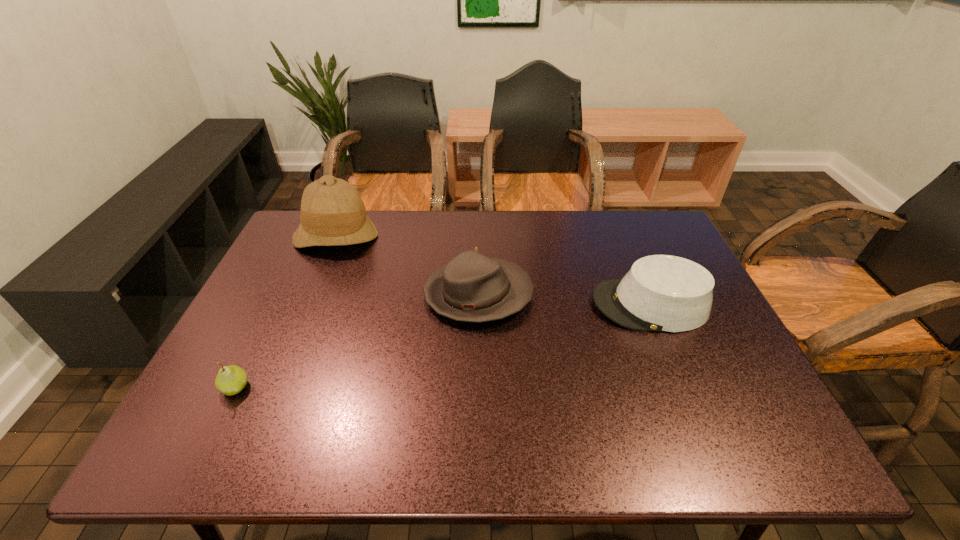
In order to click on vacant region located 0.310m on the back of the pear in this screenshot , I will do `click(286, 285)`.

At what (x,y) coordinates should I click in order to perform the action: click on object situated at the far edge. Please return your answer as a coordinate pair (x, y). The height and width of the screenshot is (540, 960). Looking at the image, I should click on (332, 213).

You are a GUI agent. You are given a task and a screenshot of the screen. Output one action in this format:
    pyautogui.click(x=<x>, y=<y>)
    Task: Click on the hat that is at the left edge
    
    Given the screenshot: What is the action you would take?
    pyautogui.click(x=332, y=213)

In order to click on pear that is at the left edge in this screenshot , I will do `click(230, 380)`.

In order to click on object at the right edge in this screenshot , I will do `click(665, 293)`.

Locate an element on the screen. Image resolution: width=960 pixels, height=540 pixels. object that is at the far left corner is located at coordinates (332, 213).

Find the location of `vacant area at the far edge`. vacant area at the far edge is located at coordinates (523, 218).

The height and width of the screenshot is (540, 960). I want to click on free space at the near edge of the desktop, so click(599, 434).

I want to click on free location at the left edge of the desktop, so click(315, 284).

Locate an element on the screen. vacant space at the far right corner is located at coordinates (648, 251).